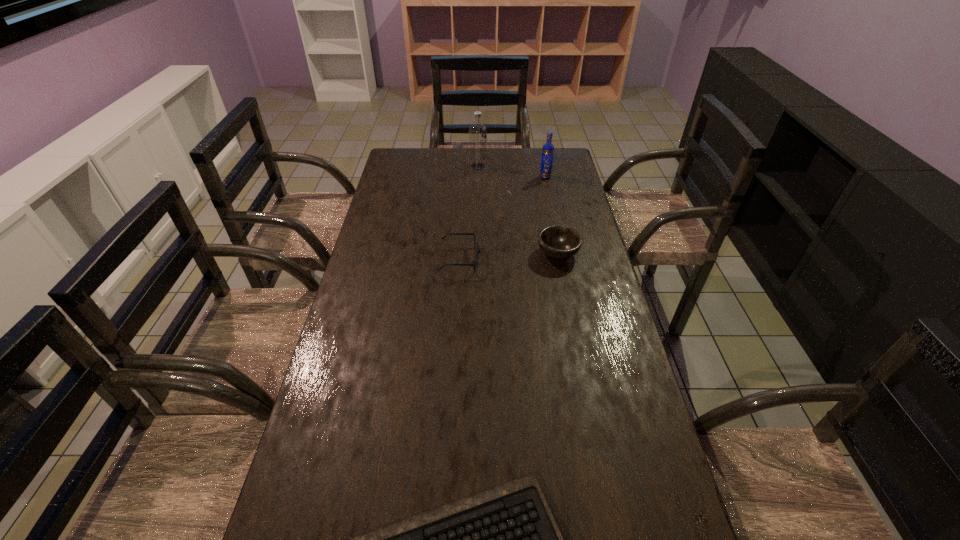
Locate an element on the screen. the farther vodka is located at coordinates (477, 132).

This screenshot has height=540, width=960. Find the location of `the farthest object`. the farthest object is located at coordinates (477, 132).

You are a GUI agent. You are given a task and a screenshot of the screen. Output one action in this format:
    pyautogui.click(x=<x>, y=<y>)
    Task: Click on the fourth shortest object
    This screenshot has width=960, height=540.
    Given the screenshot: What is the action you would take?
    pyautogui.click(x=548, y=149)

The image size is (960, 540). In order to click on the nearer vodka in this screenshot , I will do `click(548, 149)`.

Find the location of a particular element. This screenshot has width=960, height=540. bowl is located at coordinates (557, 241).

What are the coordinates of `spectacles` in the screenshot? It's located at (478, 249).

Find the location of `blank space located 0.340m on the front label of the farthest object`. blank space located 0.340m on the front label of the farthest object is located at coordinates (564, 166).

Where is `blank area located 0.290m on the front of the shorter vodka`? blank area located 0.290m on the front of the shorter vodka is located at coordinates (555, 220).

Locate an element on the screen. vacant area situated on the back of the bowl is located at coordinates (543, 183).

At what (x,y) coordinates should I click in order to perform the action: click on vacant space located 0.170m on the front-facing side of the second shortest object. Please return your answer as a coordinate pair (x, y). This screenshot has width=960, height=540. Looking at the image, I should click on (531, 260).